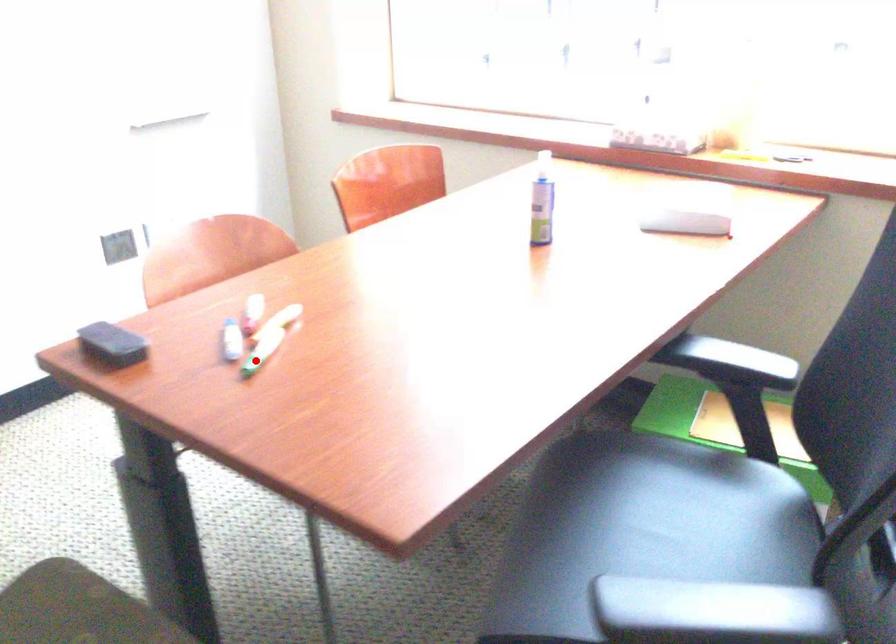
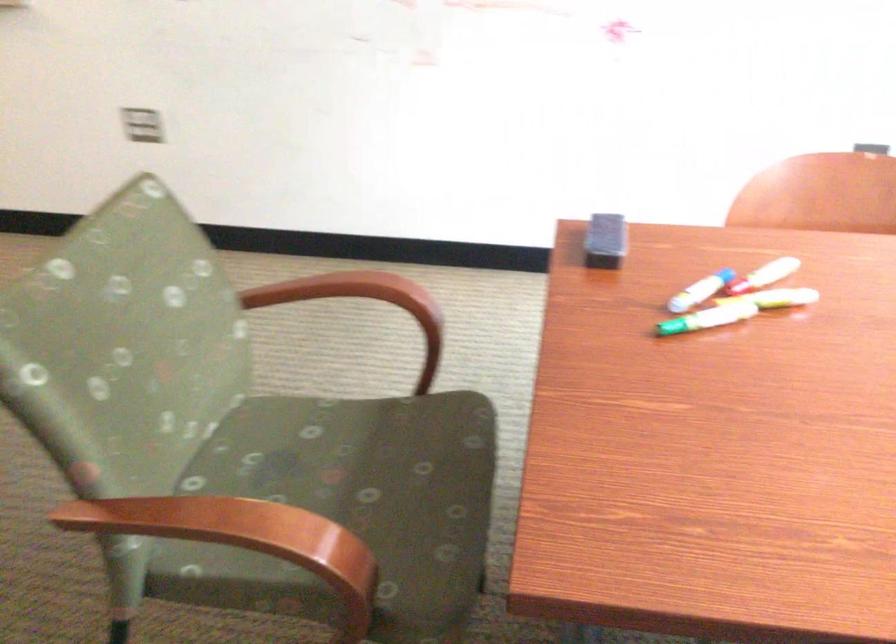
The point at the highlighted location is marked in the first image. Where is the corresponding point in the second image?

(675, 327)